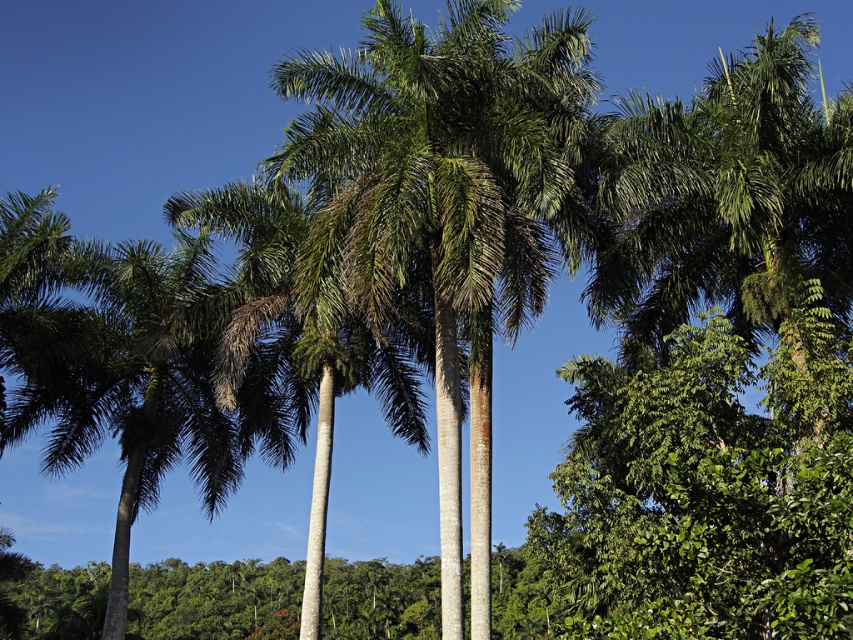
Is green leafy palm at center wider than green leafy palm tree at center?

Yes, green leafy palm at center is wider than green leafy palm tree at center.

Who is shorter, green leafy palm at center or green leafy palm tree at center?

With less height is green leafy palm tree at center.

From the picture: Who is more forward, (430, 145) or (279, 250)?

Point (430, 145) is in front.

This screenshot has width=853, height=640. In order to click on green leafy palm at center in this screenshot , I will do `click(440, 184)`.

Is green leafy palm at center taller than green leafy palm tree at left?

Yes, green leafy palm at center is taller than green leafy palm tree at left.

Who is more forward, [425,200] or [216,464]?

Point [425,200] is more forward.

Image resolution: width=853 pixels, height=640 pixels. Find the location of `green leafy palm at center`. green leafy palm at center is located at coordinates (440, 184).

In the scene shown: Does green leafy palm tree at left have a greater height compared to green leafy palm tree at center?

No.

Does green leafy palm tree at left have a larger size compared to green leafy palm tree at center?

Actually, green leafy palm tree at left might be smaller than green leafy palm tree at center.

Is point (154, 477) less distant than point (326, 422)?

No.

What are the coordinates of `green leafy palm tree at left` in the screenshot? It's located at (135, 381).